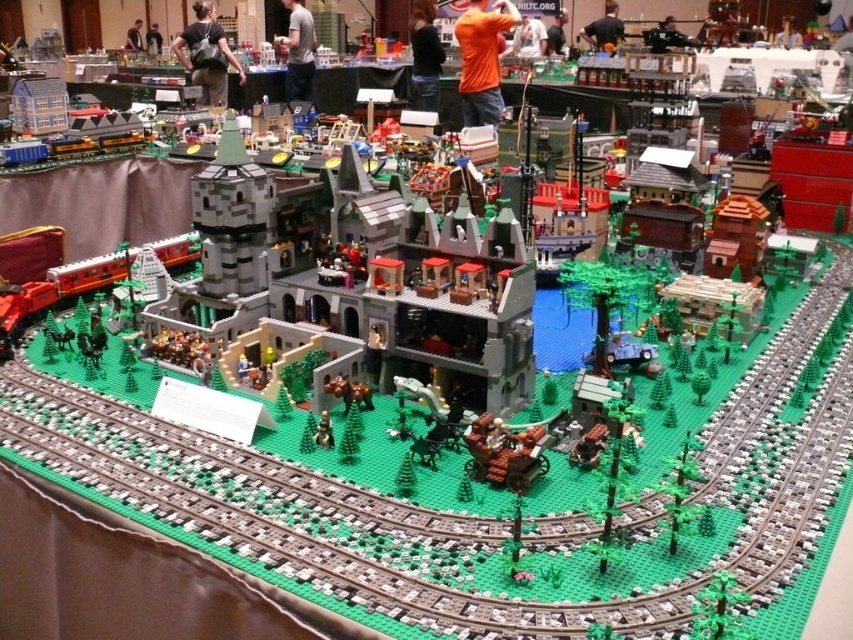
Question: Does green plastic train track at center appear over black fabric shirt at upper center?

Choices:
 (A) yes
 (B) no

Answer: (B)

Question: Which point is closer to the camera?

Choices:
 (A) smooth white shirt at center
 (B) black leather jacket at center
 (C) matte black shirt at center

Answer: (B)

Question: Does green plastic train track at center appear on the left side of smooth gray castle at center?

Choices:
 (A) no
 (B) yes

Answer: (A)

Question: Based on their relative distances, which object is farther from the orange fabric shirt at center?

Choices:
 (A) green plastic train track at center
 (B) black leather jacket at center

Answer: (A)

Question: Can you confirm if brown matte horse-drawn carriage at center is bigger than smooth white shirt at center?

Choices:
 (A) yes
 (B) no

Answer: (B)

Question: Which object is farther from the camera taking this photo?

Choices:
 (A) matte black shirt at upper center
 (B) black leather bag at upper center
 (C) black leather jacket at center

Answer: (A)